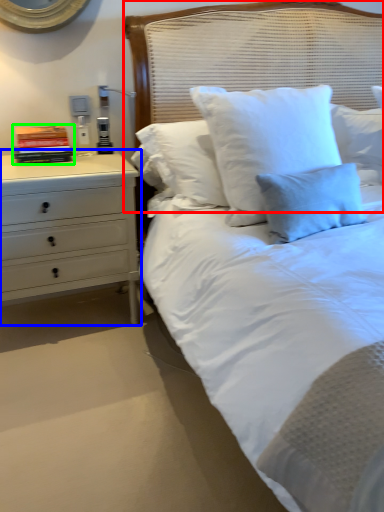
Question: Which is farther away from headboard (highlighted by a red box)? chest of drawers (highlighted by a blue box) or book (highlighted by a green box)?

Choices:
 (A) chest of drawers
 (B) book

Answer: (B)